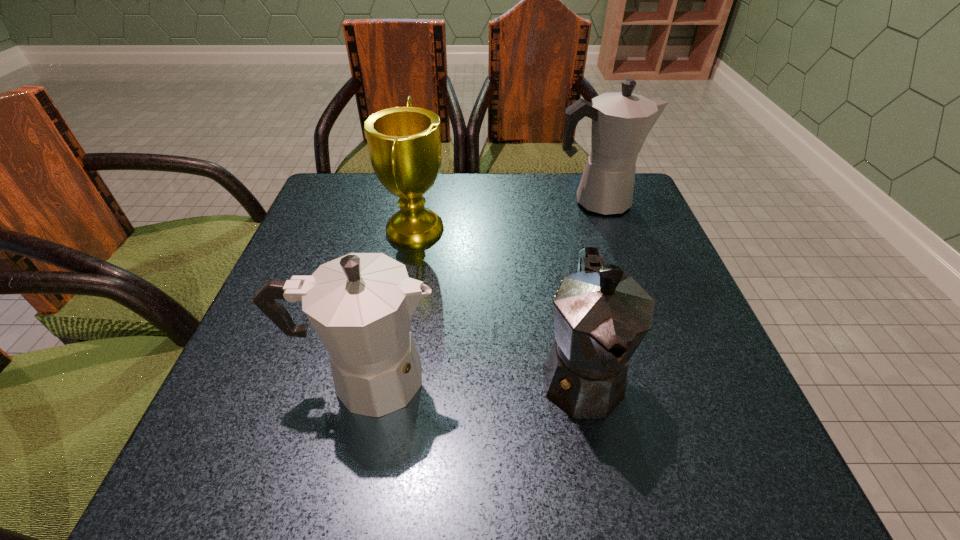
Where is `object at the right edge`? This screenshot has height=540, width=960. object at the right edge is located at coordinates (621, 121).

Identify the location of object that is at the far right corner. (621, 121).

Locate an element on the screen. This screenshot has height=540, width=960. vacant point at the far edge is located at coordinates (451, 186).

Locate an element on the screen. This screenshot has width=960, height=540. vacant space at the near edge of the desktop is located at coordinates (408, 481).

Locate an element on the screen. This screenshot has height=540, width=960. vacant area at the left edge of the desktop is located at coordinates (292, 397).

This screenshot has width=960, height=540. I want to click on vacant region at the right edge of the desktop, so click(x=687, y=397).

Where is `free space at the far left corner of the desktop`? The width and height of the screenshot is (960, 540). free space at the far left corner of the desktop is located at coordinates (x=370, y=177).

In the image, there is a desktop. Where is `vacant space at the far right corner`? vacant space at the far right corner is located at coordinates (653, 215).

The width and height of the screenshot is (960, 540). Identify the location of vacant space at the near right corner of the desktop. (770, 462).

Identify the location of empty location between the award and the farthest coffeepot. The image size is (960, 540). (507, 214).